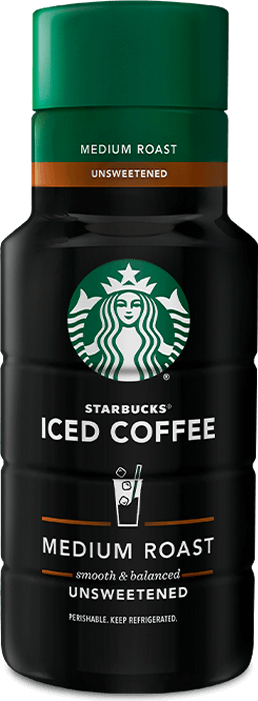
You are a GUI agent. You are given a task and a screenshot of the screen. Output one action in this format:
    pyautogui.click(x=<x>, y=<y>)
    Task: Click on the glass
    This screenshot has width=258, height=701.
    Given the screenshot: What is the action you would take?
    pyautogui.click(x=118, y=489)